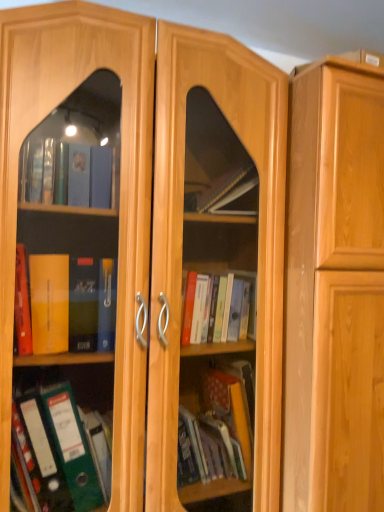
The height and width of the screenshot is (512, 384). Describe the element at coordinates (335, 290) in the screenshot. I see `light wood cupboard at right` at that location.

This screenshot has height=512, width=384. In order to click on light wood cupboard at right in this screenshot , I will do `click(335, 290)`.

Locate an element on the screen. Image resolution: width=384 pixels, height=512 pixels. light wood cupboard at right is located at coordinates (335, 290).